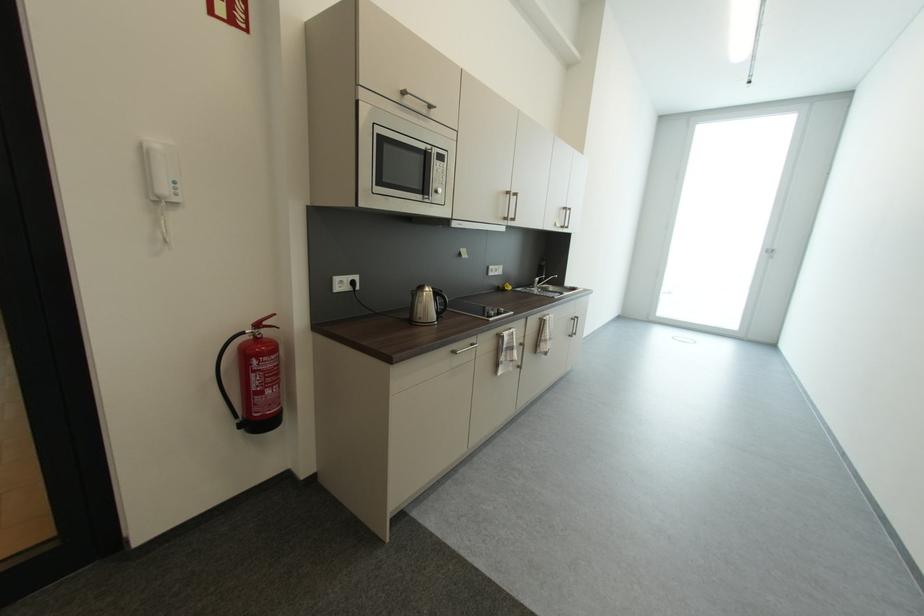
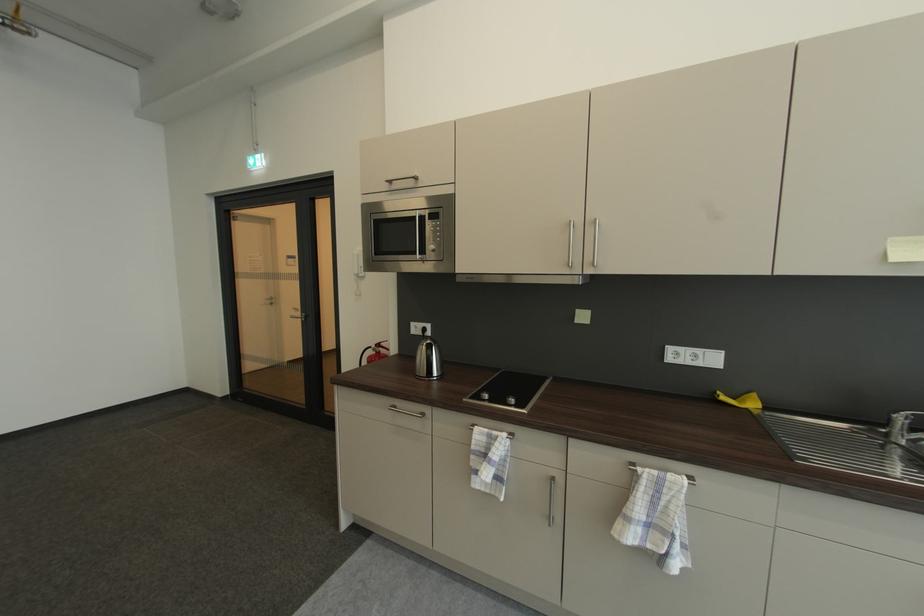
Where in the second image is the point corresponding to point 444,155 from the first image?

(436, 215)